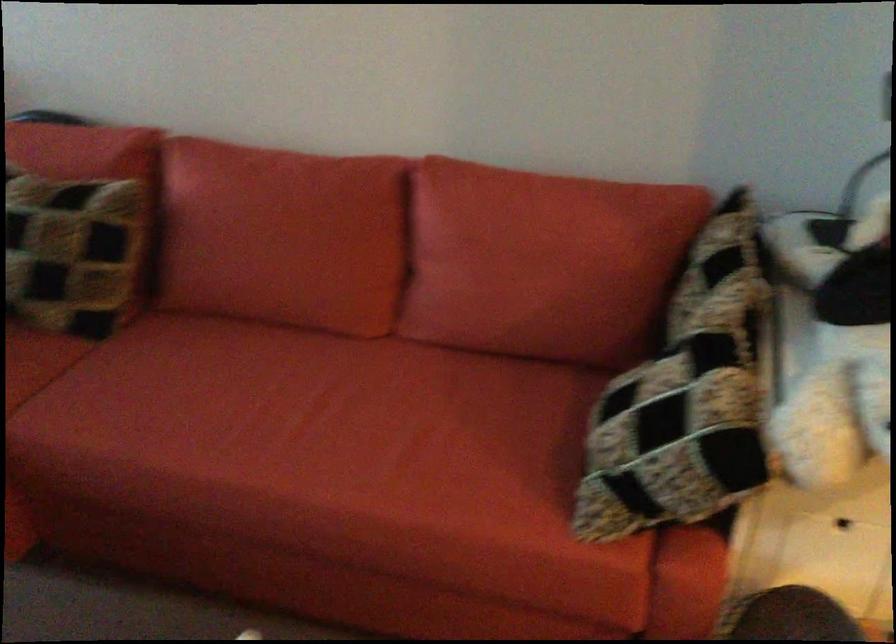
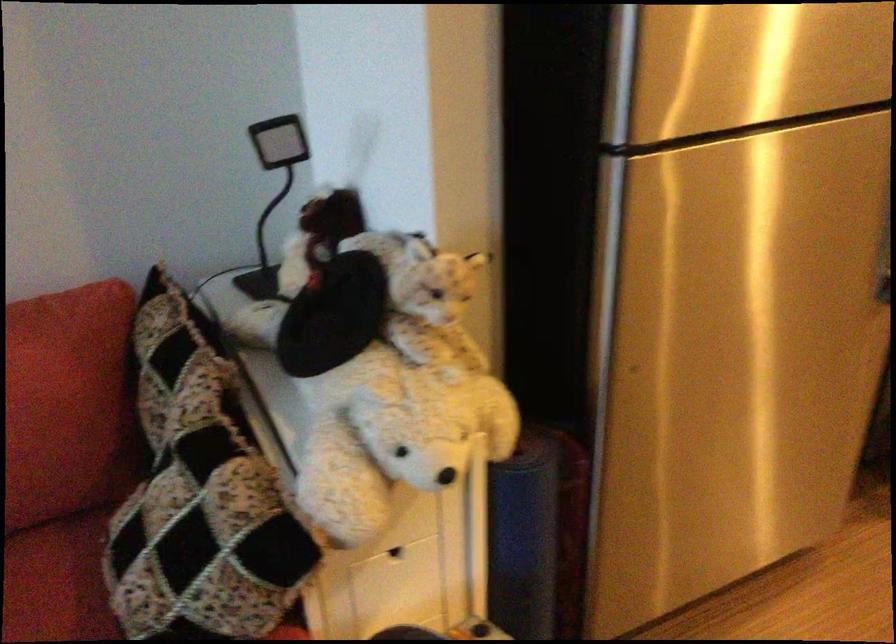
Question: How did the camera likely rotate?

Choices:
 (A) Left
 (B) Right
 (C) Up
 (D) Down

Answer: (B)